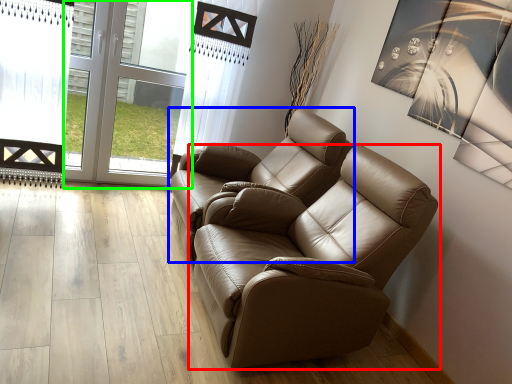
Question: Considering the real-world distances, which object is closest to chair (highlighted by a red box)? chair (highlighted by a blue box) or glass door (highlighted by a green box).

Choices:
 (A) chair
 (B) glass door

Answer: (A)